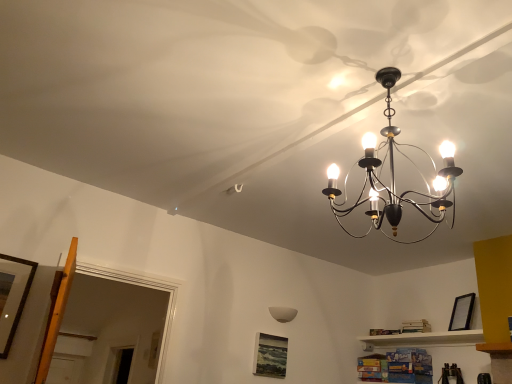
Question: Does white matte lampshade at center contain black matte picture frame at upper right, arranged as the second picture frame when ordered from the bottom?

Choices:
 (A) yes
 (B) no

Answer: (B)

Question: Is white matte lampshade at center in contact with black matte picture frame at upper right, arranged as the 2th picture frame when viewed from the top?

Choices:
 (A) yes
 (B) no

Answer: (B)

Question: Can you confirm if white matte lampshade at center is bigger than black matte picture frame at upper right, positioned as the third picture frame in left-to-right order?

Choices:
 (A) yes
 (B) no

Answer: (B)

Question: Considering the relative sizes of white matte lampshade at center and black matte picture frame at upper right, the second picture frame from the back, in the image provided, is white matte lampshade at center wider than black matte picture frame at upper right, the second picture frame from the back,?

Choices:
 (A) no
 (B) yes

Answer: (A)

Question: Are white matte lampshade at center and black matte picture frame at upper right, arranged as the 2th picture frame when viewed from the top, located far from each other?

Choices:
 (A) no
 (B) yes

Answer: (B)

Question: Does point (287, 307) appear closer or farther from the camera than point (11, 307)?

Choices:
 (A) farther
 (B) closer

Answer: (A)

Question: Is white matte lampshade at center inside or outside of wooden picture frame at left, which is the 1th picture frame from front to back?

Choices:
 (A) inside
 (B) outside

Answer: (B)

Question: From a real-world perspective, is white matte lampshade at center positioned above or below wooden picture frame at left, which ranks as the first picture frame in top-to-bottom order?

Choices:
 (A) above
 (B) below

Answer: (A)

Question: Considering the relative positions of white matte lampshade at center and wooden picture frame at left, which is the 1th picture frame from front to back, in the image provided, is white matte lampshade at center to the left or to the right of wooden picture frame at left, which is the 1th picture frame from front to back,?

Choices:
 (A) right
 (B) left

Answer: (A)

Question: Considering the relative positions of black matte picture frame at upper right, arranged as the second picture frame when ordered from the bottom, and matte black picture frame at lower center, which ranks as the 1th picture frame in bottom-to-top order, in the image provided, is black matte picture frame at upper right, arranged as the second picture frame when ordered from the bottom, to the left or to the right of matte black picture frame at lower center, which ranks as the 1th picture frame in bottom-to-top order,?

Choices:
 (A) right
 (B) left

Answer: (A)

Question: Is black matte picture frame at upper right, the second picture frame from the back, spatially inside matte black picture frame at lower center, positioned as the 2th picture frame in right-to-left order, or outside of it?

Choices:
 (A) outside
 (B) inside

Answer: (A)

Question: From a real-world perspective, relative to matte black picture frame at lower center, which is counted as the third picture frame, starting from the front, is black matte picture frame at upper right, arranged as the second picture frame when ordered from the bottom, vertically above or below?

Choices:
 (A) below
 (B) above

Answer: (B)

Question: From the image's perspective, is black matte picture frame at upper right, the second picture frame from the back, above or below matte black picture frame at lower center, the 2th picture frame when ordered from left to right?

Choices:
 (A) below
 (B) above

Answer: (B)

Question: From the image's perspective, is wooden picture frame at left, which ranks as the first picture frame in top-to-bottom order, located above or below white matte lampshade at center?

Choices:
 (A) below
 (B) above

Answer: (B)

Question: Considering the positions of wooden picture frame at left, which is the 1th picture frame from front to back, and white matte lampshade at center in the image, is wooden picture frame at left, which is the 1th picture frame from front to back, taller or shorter than white matte lampshade at center?

Choices:
 (A) short
 (B) tall

Answer: (B)